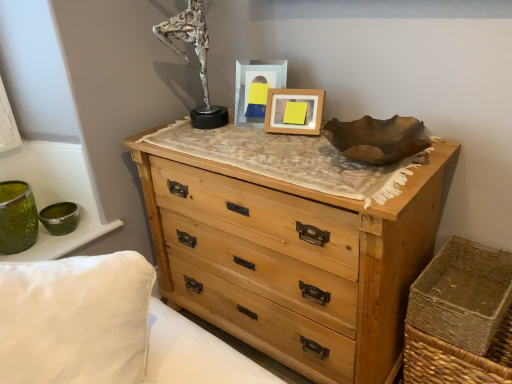
Question: Does wooden picture frame at center, which appears as the second picture frame when viewed from the left, have a lesser width compared to matte plastic picture frame at center, which is counted as the 1th picture frame, starting from the left?

Choices:
 (A) yes
 (B) no

Answer: (A)

Question: Does wooden picture frame at center, which appears as the second picture frame when viewed from the left, have a larger size compared to matte plastic picture frame at center, the 2th picture frame from the right?

Choices:
 (A) no
 (B) yes

Answer: (A)

Question: Does wooden picture frame at center, which appears as the second picture frame when viewed from the left, lie in front of matte plastic picture frame at center, which is counted as the 1th picture frame, starting from the left?

Choices:
 (A) no
 (B) yes

Answer: (B)

Question: From a real-world perspective, is wooden picture frame at center, marked as the 1th picture frame in a right-to-left arrangement, below matte plastic picture frame at center, the 2th picture frame from the right?

Choices:
 (A) no
 (B) yes

Answer: (B)

Question: Considering the relative sizes of wooden picture frame at center, which appears as the second picture frame when viewed from the left, and matte plastic picture frame at center, which is counted as the 1th picture frame, starting from the left, in the image provided, is wooden picture frame at center, which appears as the second picture frame when viewed from the left, taller than matte plastic picture frame at center, which is counted as the 1th picture frame, starting from the left,?

Choices:
 (A) yes
 (B) no

Answer: (B)

Question: From the image's perspective, is matte plastic picture frame at center, which is counted as the 1th picture frame, starting from the left, positioned above or below brown woven basket at lower right?

Choices:
 (A) above
 (B) below

Answer: (A)

Question: In terms of width, does matte plastic picture frame at center, which is counted as the 1th picture frame, starting from the left, look wider or thinner when compared to brown woven basket at lower right?

Choices:
 (A) wide
 (B) thin

Answer: (B)

Question: Does point (280, 69) appear closer or farther from the camera than point (485, 279)?

Choices:
 (A) closer
 (B) farther

Answer: (B)

Question: Considering their positions, is matte plastic picture frame at center, the 2th picture frame from the right, located in front of or behind brown woven basket at lower right?

Choices:
 (A) behind
 (B) front

Answer: (A)

Question: In the image, is brown woven basket at lower right positioned in front of or behind silver metallic sculpture at upper center?

Choices:
 (A) behind
 (B) front

Answer: (B)

Question: From a real-world perspective, is brown woven basket at lower right above or below silver metallic sculpture at upper center?

Choices:
 (A) below
 (B) above

Answer: (A)

Question: In terms of width, does brown woven basket at lower right look wider or thinner when compared to silver metallic sculpture at upper center?

Choices:
 (A) wide
 (B) thin

Answer: (A)

Question: In terms of size, does brown woven basket at lower right appear bigger or smaller than silver metallic sculpture at upper center?

Choices:
 (A) big
 (B) small

Answer: (B)

Question: Considering the positions of point (199, 109) and point (291, 208), is point (199, 109) closer or farther from the camera than point (291, 208)?

Choices:
 (A) closer
 (B) farther

Answer: (B)

Question: Would you say silver metallic sculpture at upper center is to the left or to the right of natural wood chest of drawers at center in the picture?

Choices:
 (A) right
 (B) left

Answer: (B)